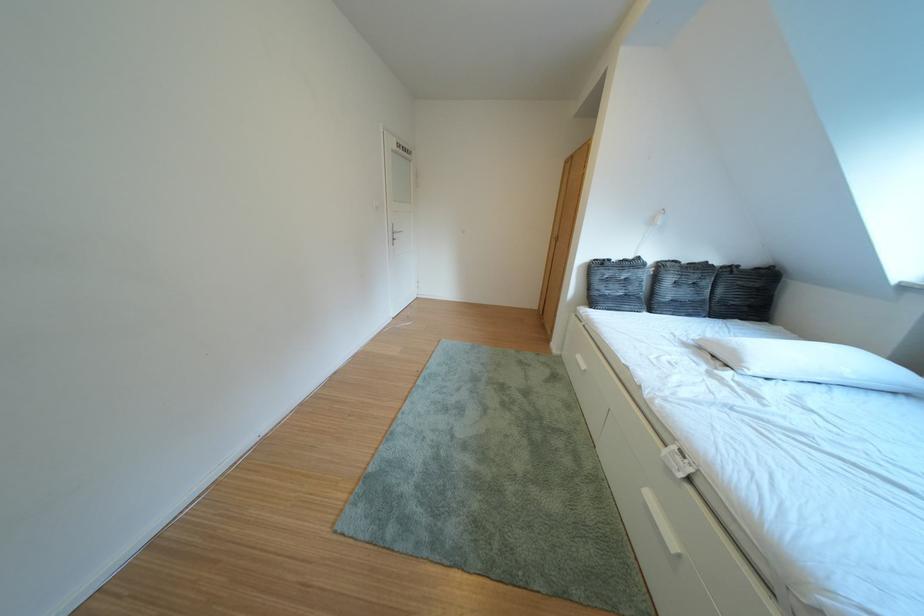
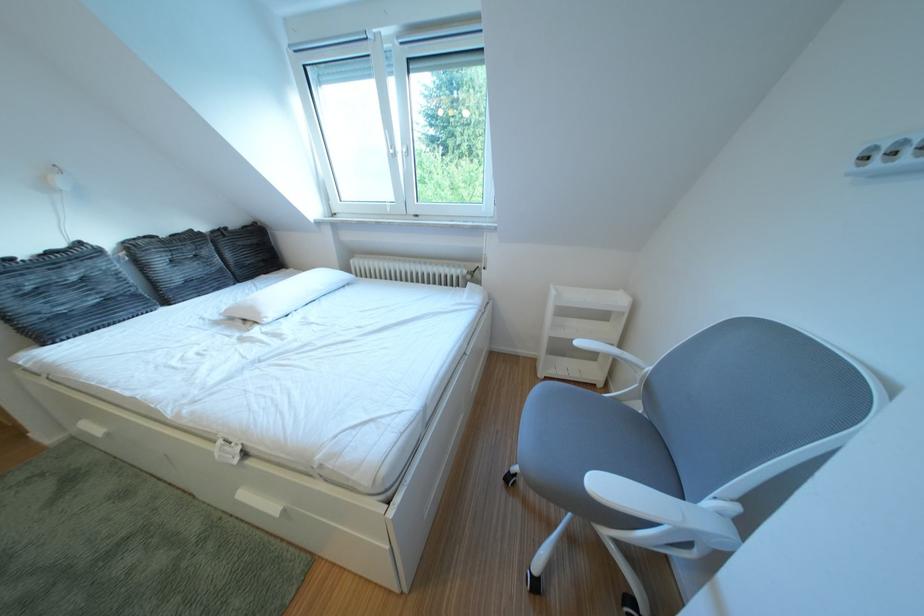
Find the pixel in the second image that matches (755,366) in the first image.

(273, 318)